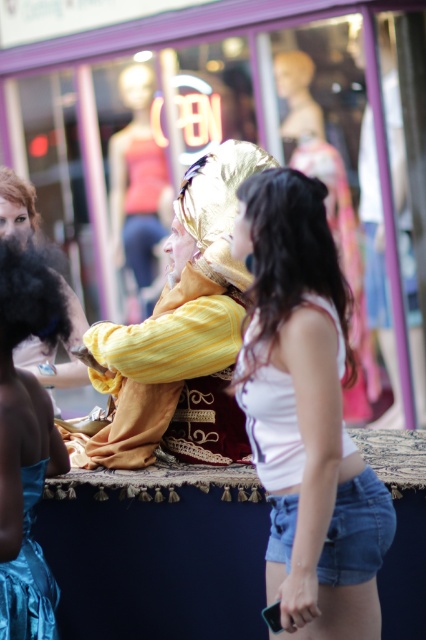
Question: Is black fuzzy wig at left positioned at the back of matte black wig at upper left?

Choices:
 (A) no
 (B) yes

Answer: (A)

Question: Does gold fabric mask at center have a greater width compared to shiny gold wig at center?

Choices:
 (A) yes
 (B) no

Answer: (A)

Question: Is white denim shorts at center smaller than blonde synthetic wig at upper left?

Choices:
 (A) yes
 (B) no

Answer: (B)

Question: Which point is farther to the camera?

Choices:
 (A) white denim shorts at center
 (B) blonde synthetic wig at upper left
 (C) matte gold headpiece at center

Answer: (C)

Question: Which object appears closest to the camera in this image?

Choices:
 (A) white denim shorts at center
 (B) matte gold headpiece at center

Answer: (A)

Question: Which object is farther from the camera taking this photo?

Choices:
 (A) shiny teal fabric dress at lower left
 (B) blonde synthetic wig at upper left

Answer: (B)